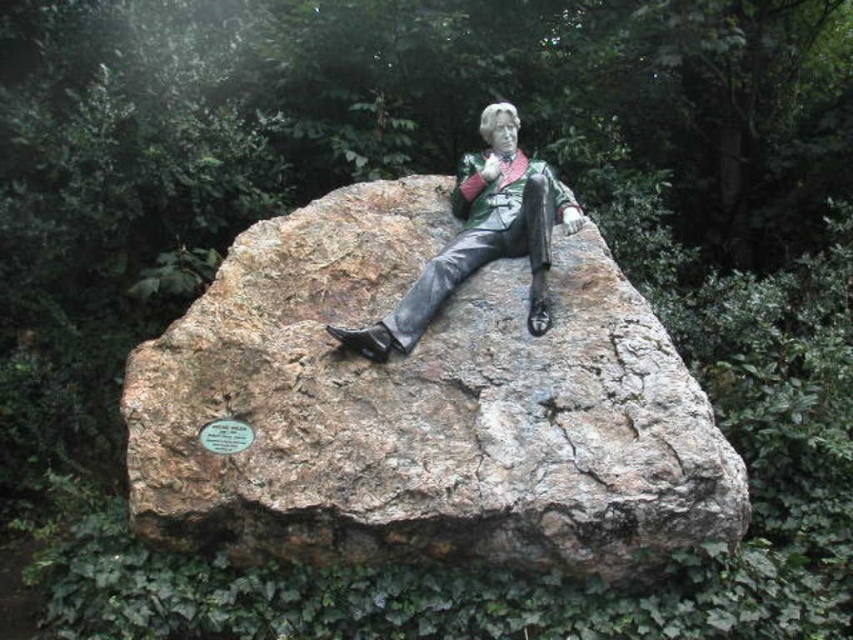
Question: Which object appears farthest from the camera in this image?

Choices:
 (A) bronze statue at center
 (B) rustic stone at center

Answer: (A)

Question: Does rustic stone at center have a larger size compared to bronze statue at center?

Choices:
 (A) no
 (B) yes

Answer: (B)

Question: Does rustic stone at center appear over bronze statue at center?

Choices:
 (A) yes
 (B) no

Answer: (B)

Question: Which object is farther from the camera taking this photo?

Choices:
 (A) bronze statue at center
 (B) rustic stone at center

Answer: (A)

Question: Does rustic stone at center appear under bronze statue at center?

Choices:
 (A) no
 (B) yes

Answer: (B)